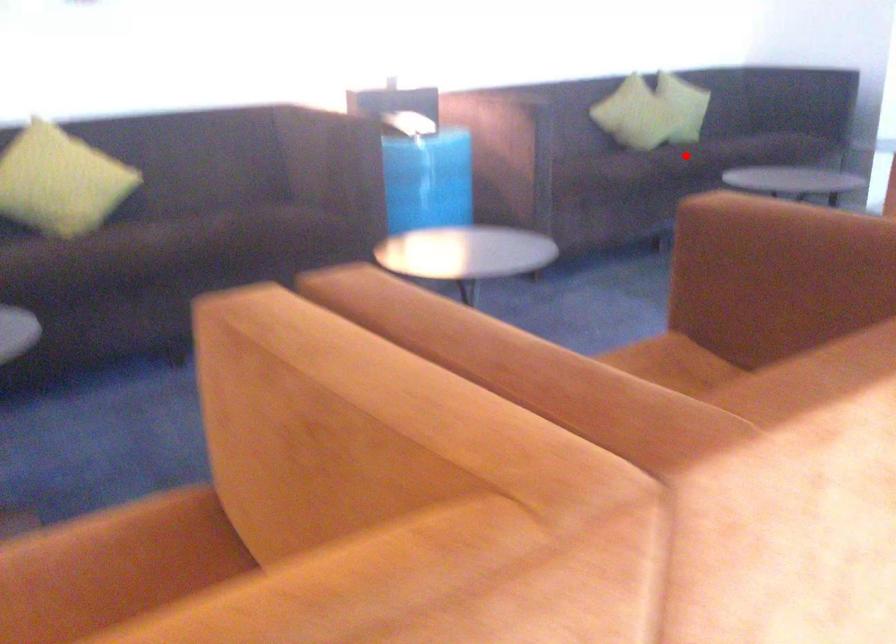
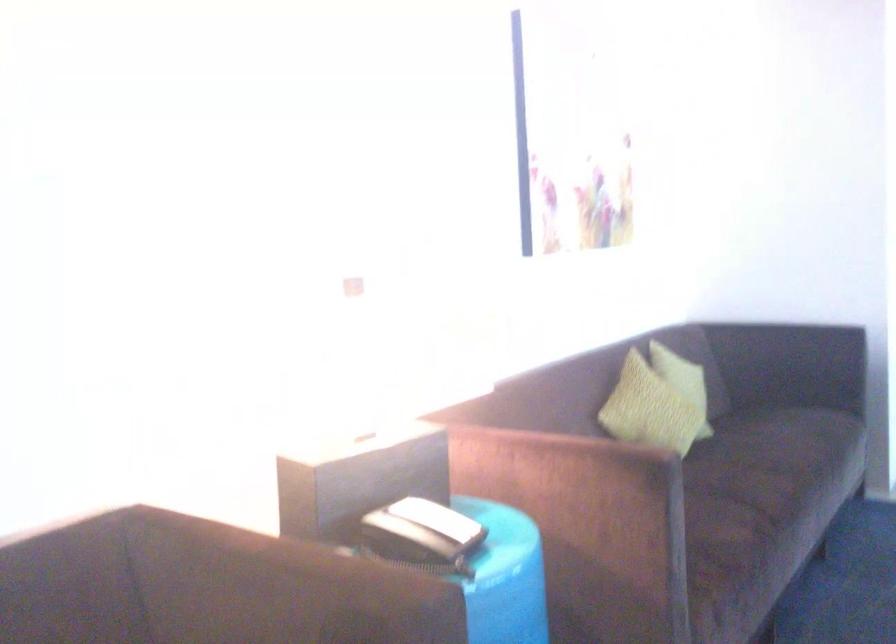
Question: I am providing you with two images of the same scene from different viewpoints. A red point is shown in image1. For the corresponding object point in image2, is it positioned nearer or farther from the camera?

Choices:
 (A) Nearer
 (B) Farther

Answer: (A)